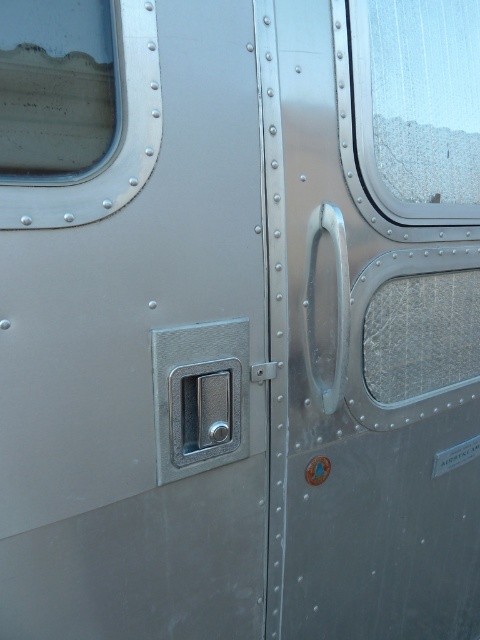
Based on the photo, you are a repair technician assessing the metallic surface of a vintage trailer. You notice the metallic textured window at upper left and the metallic gray lock at center. Which object is taller?

The metallic textured window at upper left is taller than the metallic gray lock at center.

You are standing in front of a vintage trailer and notice a point marked at coordinates (32, 172) on its metallic surface. If you want to reach that point with a tool that has a maximum reach of 3 feet, will you be able to do so?

The distance between the point at coordinates (32, 172) and the viewer is 3.42 feet, which exceeds the tool s maximum reach of 3 feet. Therefore, you won t be able to reach the point with the tool.